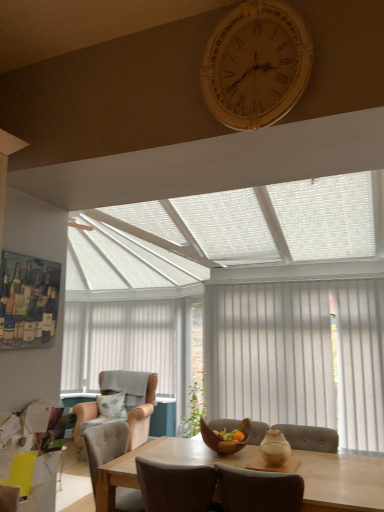
This screenshot has width=384, height=512. I want to click on wooden clock at upper center, so click(x=256, y=65).

Describe the element at coordinates (256, 65) in the screenshot. This screenshot has width=384, height=512. I see `wooden clock at upper center` at that location.

The width and height of the screenshot is (384, 512). Describe the element at coordinates (341, 481) in the screenshot. I see `light wood table at center` at that location.

Based on the photo, what is the approximate height of beige fabric armchair at left, the first chair positioned from the back?

beige fabric armchair at left, the first chair positioned from the back, is 1.01 meters in height.

Locate an element on the screen. The height and width of the screenshot is (512, 384). fluffy fabric pillow at center is located at coordinates (112, 405).

Identify the location of beige fabric chair at lower left, the 2th chair positioned from the bottom. Image resolution: width=384 pixels, height=512 pixels. (105, 445).

Locate an element on the screen. This screenshot has height=512, width=384. beige fabric blind at center is located at coordinates coord(119,342).

Locate an element on the screen. The width and height of the screenshot is (384, 512). wooden clock at upper center is located at coordinates (256, 65).

Between point (106, 407) and point (336, 464), which one is positioned behind?

The point (106, 407) is behind.

Between fluffy fabric pillow at center and light wood table at center, which one is positioned behind?

Positioned behind is fluffy fabric pillow at center.

How different are the orientations of white vertical blinds at right and fluffy fabric pillow at center in degrees?

They differ by 18.5 degrees in their facing directions.

In terms of size, does white vertical blinds at right appear bigger or smaller than fluffy fabric pillow at center?

Clearly, white vertical blinds at right is larger in size than fluffy fabric pillow at center.

Are white vertical blinds at right and fluffy fabric pillow at center located far from each other?

Indeed, white vertical blinds at right is not near fluffy fabric pillow at center.

This screenshot has height=512, width=384. Identify the location of chair that is above the light wood table at center (from the image's perspective). (105, 445).

Are light wood table at center and beige fabric chair at lower left, acting as the first chair starting from the top, beside each other?

There is a gap between light wood table at center and beige fabric chair at lower left, acting as the first chair starting from the top.

From the image's perspective, is light wood table at center over beige fabric chair at lower left, marked as the first chair in a front-to-back arrangement?

No, from the image's perspective, light wood table at center is not on top of beige fabric chair at lower left, marked as the first chair in a front-to-back arrangement.

Can you tell me how much wooden clock at upper center and fluffy fabric pillow at center differ in facing direction?

18.4 degrees separate the facing orientations of wooden clock at upper center and fluffy fabric pillow at center.

From the image's perspective, would you say wooden clock at upper center is shown under fluffy fabric pillow at center?

No, from the image's perspective, wooden clock at upper center is not below fluffy fabric pillow at center.

Is wooden clock at upper center oriented away from fluffy fabric pillow at center?

No.

Considering the relative sizes of wooden clock at upper center and fluffy fabric pillow at center in the image provided, is wooden clock at upper center bigger than fluffy fabric pillow at center?

Incorrect, wooden clock at upper center is not larger than fluffy fabric pillow at center.

Is wooden clock at upper center positioned before beige fabric armchair at left, arranged as the second chair when viewed from the front?

Yes, it is in front of beige fabric armchair at left, arranged as the second chair when viewed from the front.

Is wooden clock at upper center looking in the opposite direction of beige fabric armchair at left, which appears as the 2th chair when viewed from the top?

wooden clock at upper center does not have its back to beige fabric armchair at left, which appears as the 2th chair when viewed from the top.

Which chair is the 2nd one when counting from the back of the wooden clock at upper center? Please provide its 2D coordinates.

[(142, 416)]

From the image's perspective, which one is positioned lower, wooden clock at upper center or beige fabric armchair at left, the first chair positioned from the back?

beige fabric armchair at left, the first chair positioned from the back, is shown below in the image.

Is wooden clock at upper center inside fluffy fabric pillow at center?

No, wooden clock at upper center is not a part of fluffy fabric pillow at center.

Is fluffy fabric pillow at center placed right next to wooden clock at upper center?

No, fluffy fabric pillow at center is not touching wooden clock at upper center.

Which object is positioned more to the left, fluffy fabric pillow at center or wooden clock at upper center?

fluffy fabric pillow at center.

What's the angular difference between wooden clock at upper center and beige fabric chair at lower left, marked as the first chair in a front-to-back arrangement,'s facing directions?

They differ by 84.5 degrees in their facing directions.

Is beige fabric chair at lower left, the 2th chair positioned from the bottom, at the back of wooden clock at upper center?

wooden clock at upper center does not have its back to beige fabric chair at lower left, the 2th chair positioned from the bottom.

Visually, is wooden clock at upper center positioned to the left or to the right of beige fabric chair at lower left, placed as the second chair when sorted from back to front?

wooden clock at upper center is to the right of beige fabric chair at lower left, placed as the second chair when sorted from back to front.

Between wooden clock at upper center and beige fabric chair at lower left, marked as the first chair in a front-to-back arrangement, which one has smaller size?

wooden clock at upper center.

Where is `pillow located above the light wood table at center (from a real-world perspective)`? The height and width of the screenshot is (512, 384). pillow located above the light wood table at center (from a real-world perspective) is located at coordinates (112, 405).

You are a GUI agent. You are given a task and a screenshot of the screen. Output one action in this format:
    pyautogui.click(x=<x>, y=<y>)
    Task: Click on the pillow behind the white vertical blinds at right
    
    Given the screenshot: What is the action you would take?
    pyautogui.click(x=112, y=405)

Considering their positions, is beige fabric chair at lower left, marked as the first chair in a front-to-back arrangement, positioned closer to fluffy fabric pillow at center than white vertical blinds at right?

beige fabric chair at lower left, marked as the first chair in a front-to-back arrangement, is positioned closer to the anchor fluffy fabric pillow at center.

Which object lies further to the anchor point fluffy fabric pillow at center, white vertical blinds at right or beige fabric chair at lower left, placed as the second chair when sorted from back to front?

white vertical blinds at right is further to fluffy fabric pillow at center.

Which object lies further to the anchor point beige fabric blind at center, fluffy fabric pillow at center or white vertical blinds at right?

white vertical blinds at right.

Which object lies nearer to the anchor point beige fabric armchair at left, which appears as the 2th chair when viewed from the top, light wood table at center or beige fabric chair at lower left, the 2th chair positioned from the bottom?

beige fabric chair at lower left, the 2th chair positioned from the bottom, is positioned closer to the anchor beige fabric armchair at left, which appears as the 2th chair when viewed from the top.

Which object lies further to the anchor point beige fabric blind at center, beige fabric armchair at left, the first chair positioned from the back, or light wood table at center?

light wood table at center is further to beige fabric blind at center.

When comparing their distances from beige fabric armchair at left, acting as the first chair starting from the bottom, does beige fabric blind at center or beige fabric chair at lower left, the 2th chair positioned from the bottom, seem further?

Among the two, beige fabric blind at center is located further to beige fabric armchair at left, acting as the first chair starting from the bottom.

In the scene shown: When comparing their distances from beige fabric blind at center, does fluffy fabric pillow at center or wooden clock at upper center seem further?

wooden clock at upper center.

Which object lies further to the anchor point beige fabric chair at lower left, placed as the second chair when sorted from back to front, beige fabric armchair at left, arranged as the second chair when viewed from the front, or wooden clock at upper center?

wooden clock at upper center is further to beige fabric chair at lower left, placed as the second chair when sorted from back to front.

This screenshot has width=384, height=512. In order to click on curtain positioned between beige fabric chair at lower left, marked as the first chair in a front-to-back arrangement, and beige fabric blind at center from near to far in this screenshot , I will do `click(298, 356)`.

Where is `curtain between light wood table at center and fluffy fabric pillow at center from front to back`? The width and height of the screenshot is (384, 512). curtain between light wood table at center and fluffy fabric pillow at center from front to back is located at coordinates (298, 356).

In order to click on chair between white vertical blinds at right and beige fabric blind at center along the z-axis in this screenshot , I will do `click(142, 416)`.

The image size is (384, 512). In order to click on chair between wooden clock at upper center and light wood table at center in the up-down direction in this screenshot , I will do `click(105, 445)`.